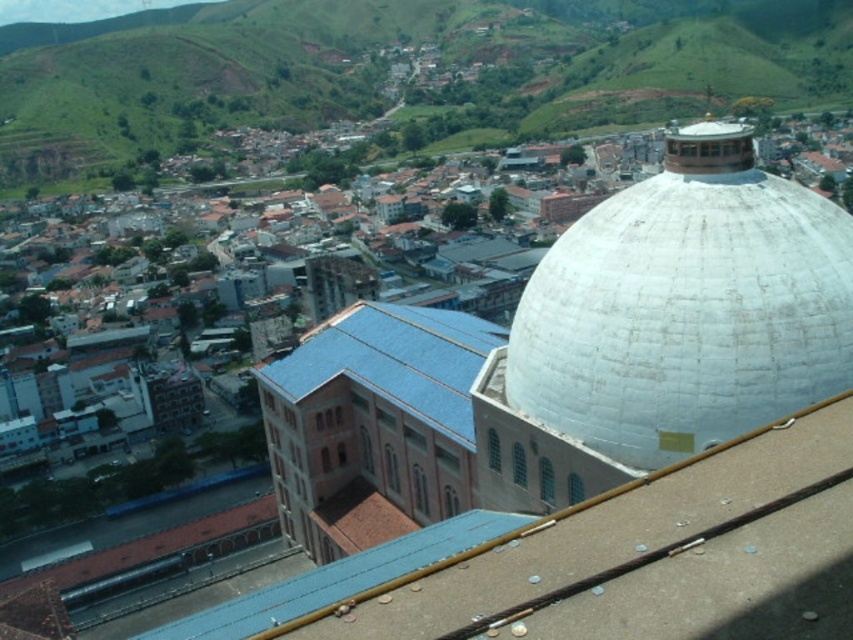
Question: Can you confirm if white matte dome at upper right is wider than blue tile roof at center?

Choices:
 (A) yes
 (B) no

Answer: (B)

Question: Among these points, which one is farthest from the camera?

Choices:
 (A) (518, 54)
 (B) (402, 376)
 (C) (689, 196)

Answer: (A)

Question: Does white matte dome at upper right lie behind blue tile roof at center?

Choices:
 (A) no
 (B) yes

Answer: (A)

Question: Does white matte dome at upper right appear over blue tile roof at center?

Choices:
 (A) yes
 (B) no

Answer: (A)

Question: Among these objects, which one is farthest from the camera?

Choices:
 (A) green grassy hillside at upper center
 (B) blue tile roof at center

Answer: (A)

Question: Which point is farther from the camera taking this photo?

Choices:
 (A) (346, 362)
 (B) (512, 64)
 (C) (683, 160)

Answer: (B)